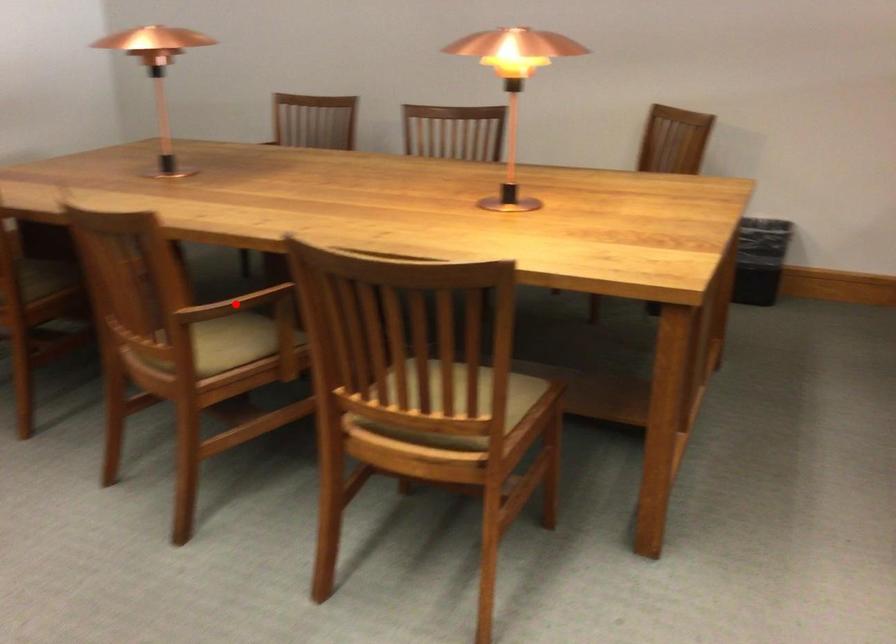
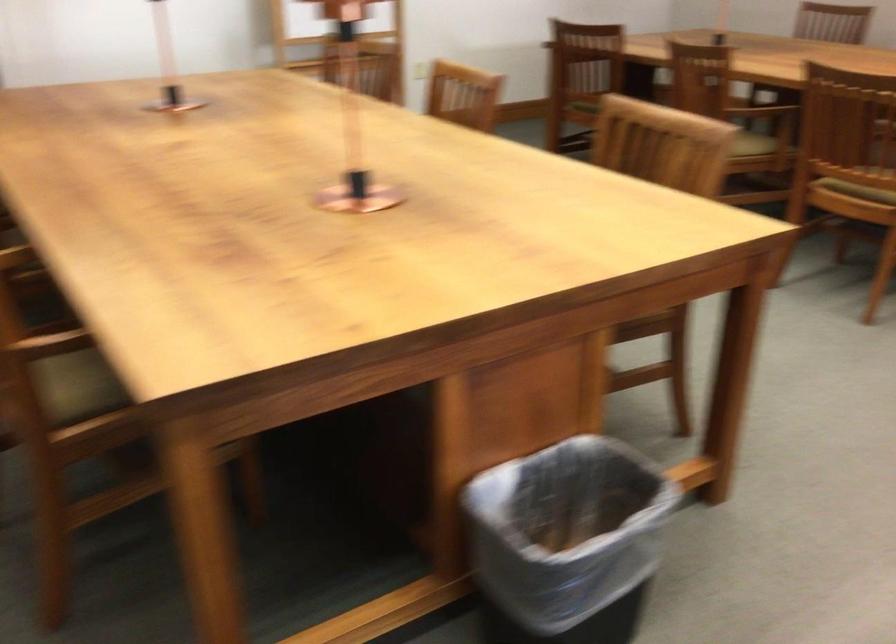
Question: I am providing you with two images of the same scene from different viewpoints. A red point is marked on the first image. At the location where the point appears in image 1, is it still visible in image 2?

Choices:
 (A) Yes
 (B) No

Answer: (B)